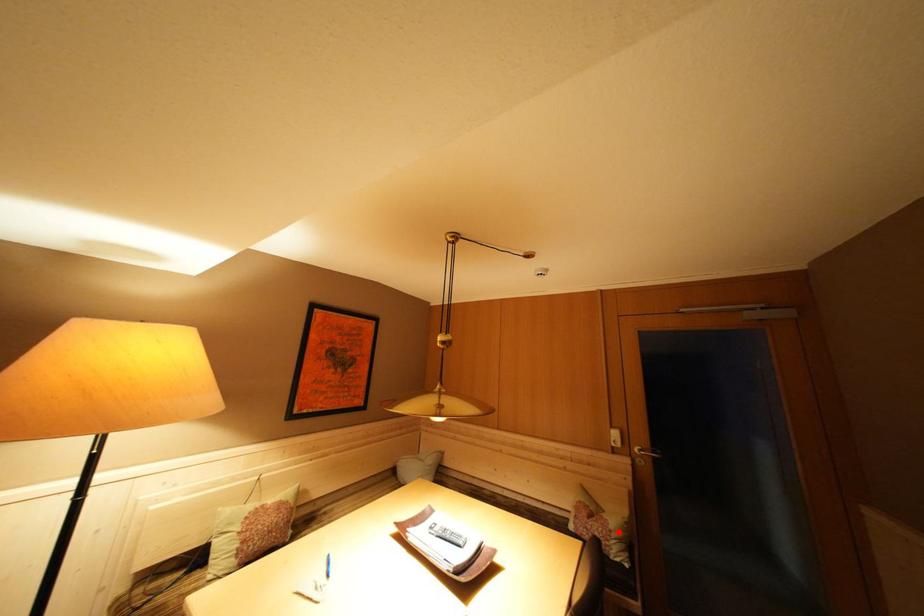
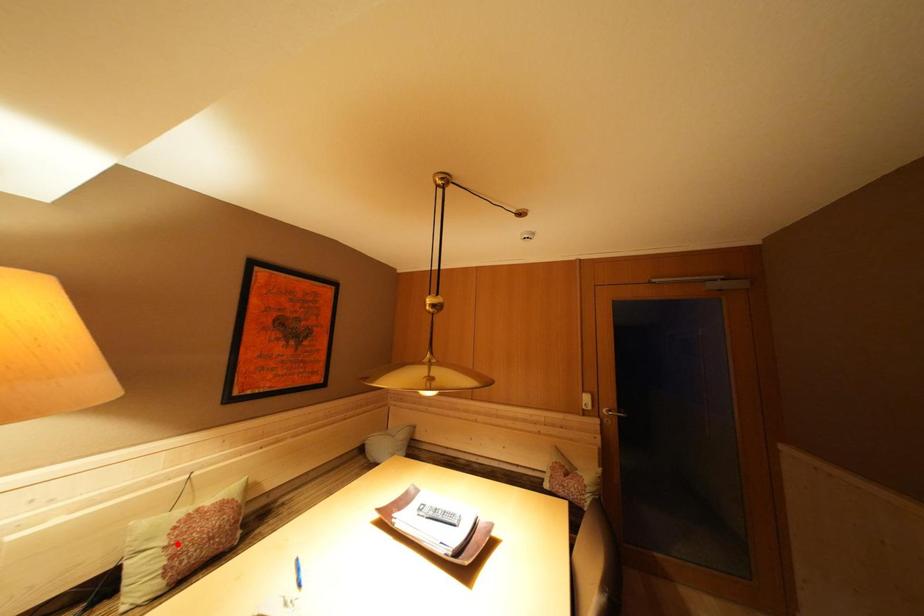
I am providing you with two images of the same scene from different viewpoints. A red point is marked on the first image and another point is marked on the second image. Is the marked point in image1 the same physical position as the marked point in image2?

No